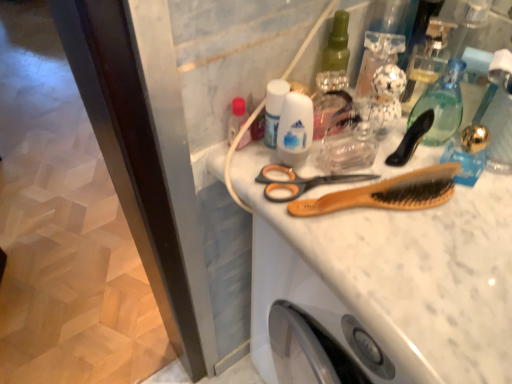
The height and width of the screenshot is (384, 512). What are the coordinates of `free region on the left part of black plastic brush at upper right` in the screenshot? It's located at (300, 172).